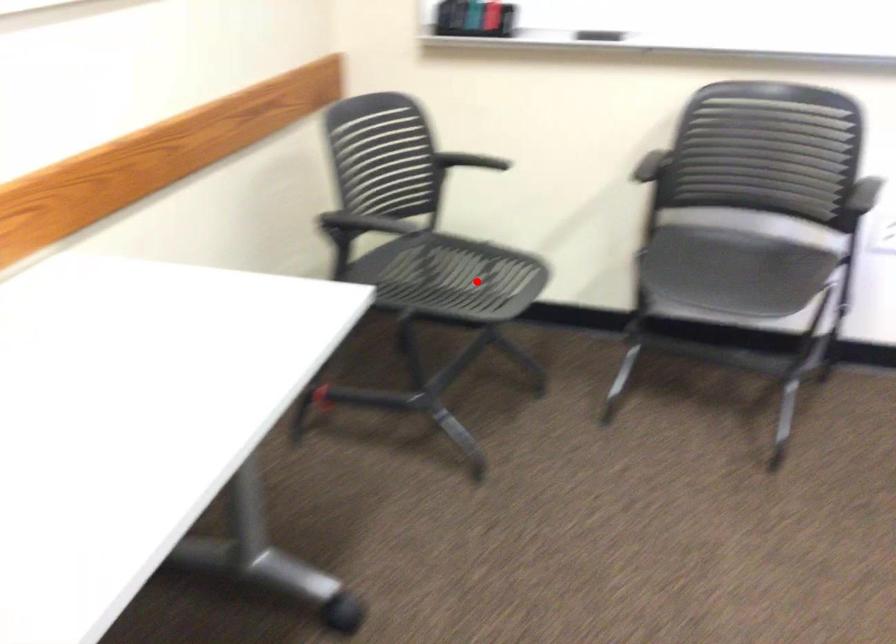
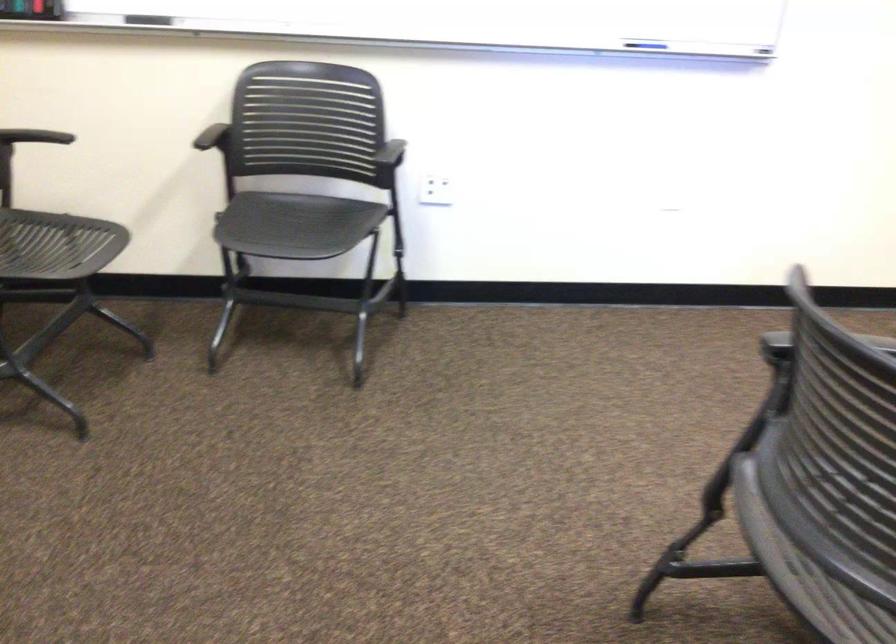
Locate, in the second image, the point that corresponds to the highlighted location in the first image.

(56, 245)